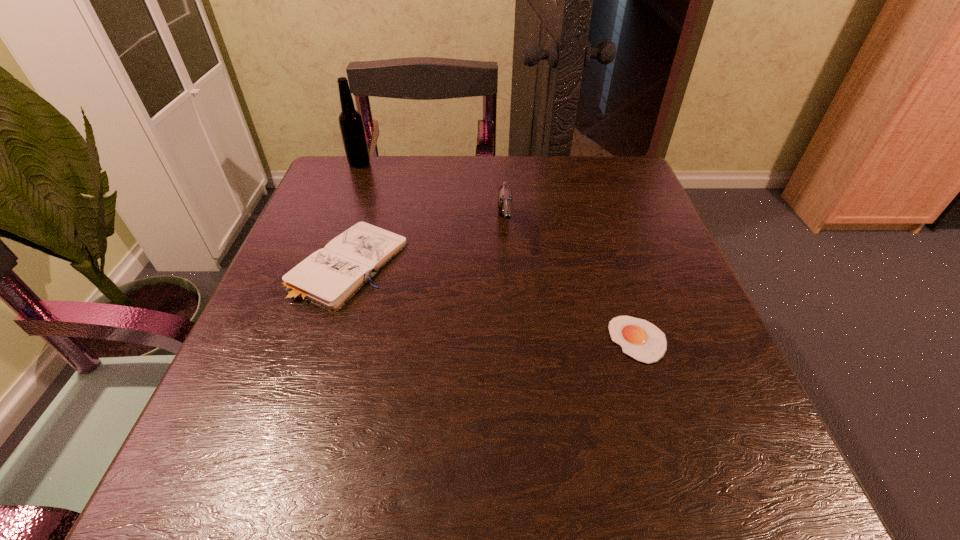
Where is `the farthest object`? The image size is (960, 540). the farthest object is located at coordinates (351, 124).

Image resolution: width=960 pixels, height=540 pixels. In order to click on the tallest object in this screenshot , I will do `click(351, 124)`.

I want to click on pistol, so click(505, 198).

The width and height of the screenshot is (960, 540). Find the location of `the third object from left to right`. the third object from left to right is located at coordinates (505, 198).

Locate an element on the screen. the second shortest object is located at coordinates (329, 277).

At what (x,y) coordinates should I click in order to perform the action: click on the shortest object. Please return your answer as a coordinate pair (x, y). The image size is (960, 540). Looking at the image, I should click on (640, 339).

Image resolution: width=960 pixels, height=540 pixels. I want to click on the nearest object, so click(640, 339).

In order to click on free space located 0.050m on the right of the tallest object in this screenshot , I will do `click(390, 164)`.

The image size is (960, 540). Find the location of `vacant space situated 0.090m at the barrel of the third shortest object`. vacant space situated 0.090m at the barrel of the third shortest object is located at coordinates (508, 285).

Where is `vacant region located on the front of the notebook`? Image resolution: width=960 pixels, height=540 pixels. vacant region located on the front of the notebook is located at coordinates (311, 381).